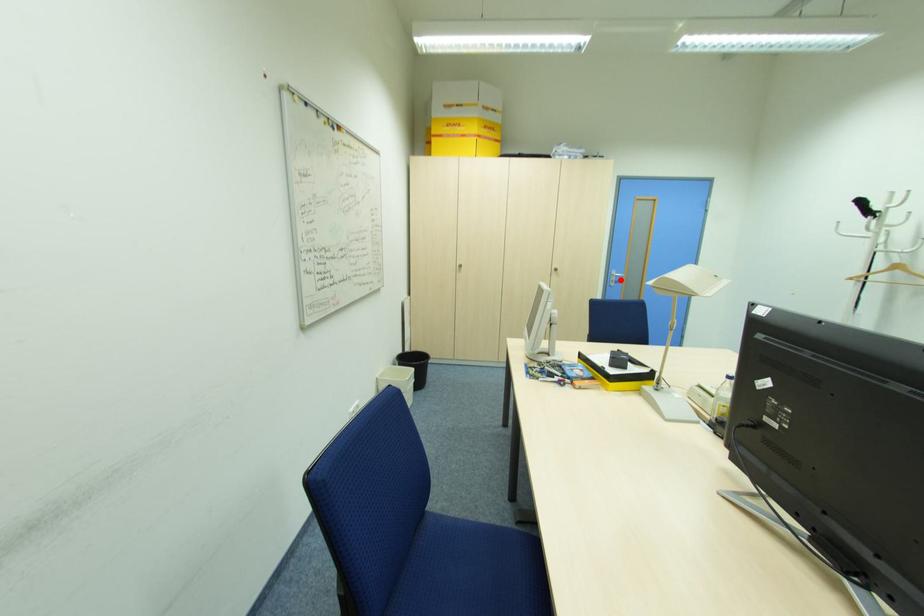
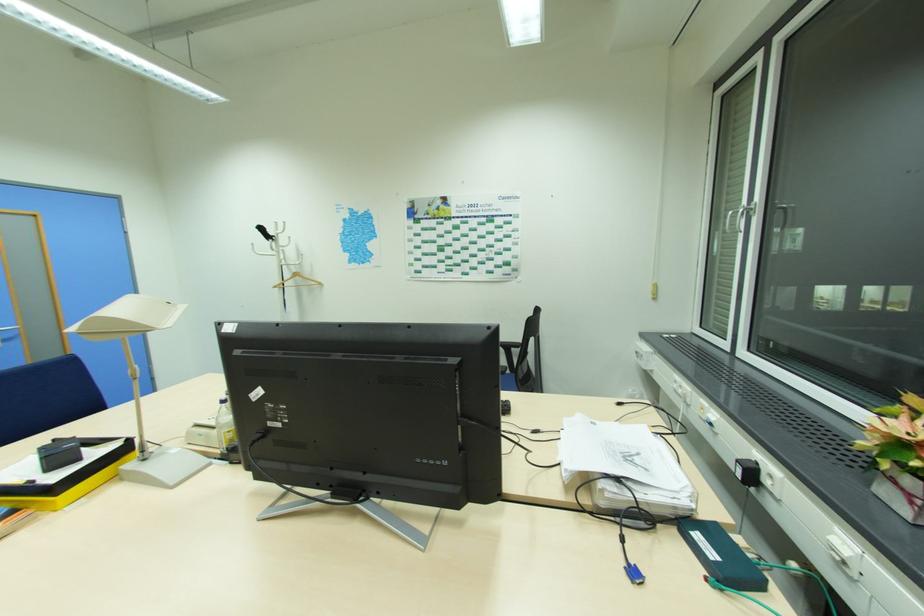
Question: I am providing you with two images of the same scene from different viewpoints. In image1, a red point is highlighted. Considering the same 3D point in image2, which of the following is correct?

Choices:
 (A) It is closer
 (B) It is farther

Answer: (B)